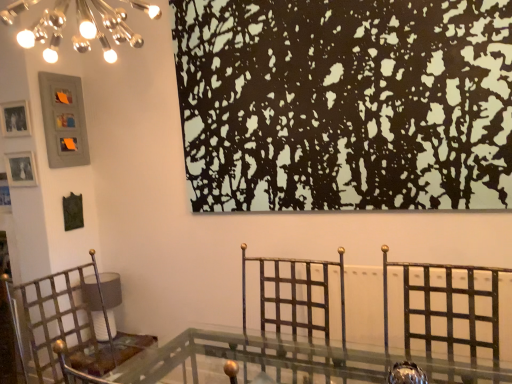
Question: Does matte gray picture frame at upper left, the 3th picture frame in the bottom-to-top sequence, have a lesser height compared to metallic gold swivel chair at center?

Choices:
 (A) yes
 (B) no

Answer: (B)

Question: From a real-world perspective, is matte gray picture frame at upper left, marked as the first picture frame in a top-to-bottom arrangement, under metallic gold swivel chair at center?

Choices:
 (A) no
 (B) yes

Answer: (A)

Question: Can you confirm if matte gray picture frame at upper left, the 3th picture frame in the bottom-to-top sequence, is wider than metallic gold swivel chair at center?

Choices:
 (A) no
 (B) yes

Answer: (A)

Question: Would you consider matte gray picture frame at upper left, marked as the first picture frame in a top-to-bottom arrangement, to be distant from metallic gold swivel chair at center?

Choices:
 (A) yes
 (B) no

Answer: (A)

Question: Is matte gray picture frame at upper left, marked as the first picture frame in a top-to-bottom arrangement, bigger than metallic gold swivel chair at center?

Choices:
 (A) yes
 (B) no

Answer: (B)

Question: Considering the relative positions of metallic gold swivel chair at center and matte gray picture frame at upper left, marked as the first picture frame in a top-to-bottom arrangement, in the image provided, is metallic gold swivel chair at center to the left or to the right of matte gray picture frame at upper left, marked as the first picture frame in a top-to-bottom arrangement,?

Choices:
 (A) right
 (B) left

Answer: (A)

Question: From a real-world perspective, relative to matte gray picture frame at upper left, the 3th picture frame in the bottom-to-top sequence, is metallic gold swivel chair at center vertically above or below?

Choices:
 (A) above
 (B) below

Answer: (B)

Question: Looking at their shapes, would you say metallic gold swivel chair at center is wider or thinner than matte gray picture frame at upper left, the 3th picture frame in the bottom-to-top sequence?

Choices:
 (A) thin
 (B) wide

Answer: (B)

Question: Is metallic gold swivel chair at center in front of or behind matte gray picture frame at upper left, marked as the first picture frame in a top-to-bottom arrangement, in the image?

Choices:
 (A) front
 (B) behind

Answer: (A)

Question: Looking at the image, does matte silver picture frame at left, the third picture frame in the top-to-bottom sequence, seem bigger or smaller compared to matte silver picture frame at upper left, the 2th picture frame positioned from the top?

Choices:
 (A) small
 (B) big

Answer: (A)

Question: From a real-world perspective, is matte silver picture frame at left, the 1th picture frame ordered from the bottom, positioned above or below matte silver picture frame at upper left, the 2th picture frame positioned from the top?

Choices:
 (A) below
 (B) above

Answer: (A)

Question: Do you think matte silver picture frame at left, the third picture frame in the top-to-bottom sequence, is within matte silver picture frame at upper left, the 2th picture frame positioned from the top, or outside of it?

Choices:
 (A) inside
 (B) outside

Answer: (B)

Question: Would you say matte silver picture frame at left, the third picture frame in the top-to-bottom sequence, is to the left or to the right of matte silver picture frame at upper left, which ranks as the second picture frame in bottom-to-top order, in the picture?

Choices:
 (A) right
 (B) left

Answer: (A)

Question: Would you say black matte painting at upper center is inside or outside metallic gold swivel chair at center?

Choices:
 (A) outside
 (B) inside

Answer: (A)

Question: Is black matte painting at upper center wider or thinner than metallic gold swivel chair at center?

Choices:
 (A) thin
 (B) wide

Answer: (A)